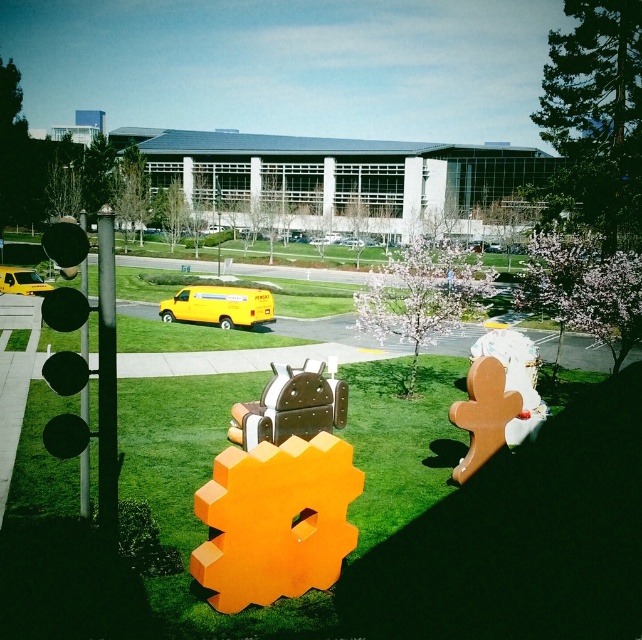
From the picture: You are a delivery person who needs to park your yellow matte van at center and yellow matte van at left in a straight line. Can you park them side by side without overlapping?

The yellow matte van at center is positioned on the right side of yellow matte van at left, so they are already aligned side by side. Therefore, you can park them without overlapping.

You are standing in the middle of the tech campus and see two points marked on the ground. The first point is at coordinate point(x=227, y=321) and the second is at coordinate point(x=10, y=275). Which point is closer to you?

Point(x=227, y=321) is closer to the viewer than point(x=10, y=275).